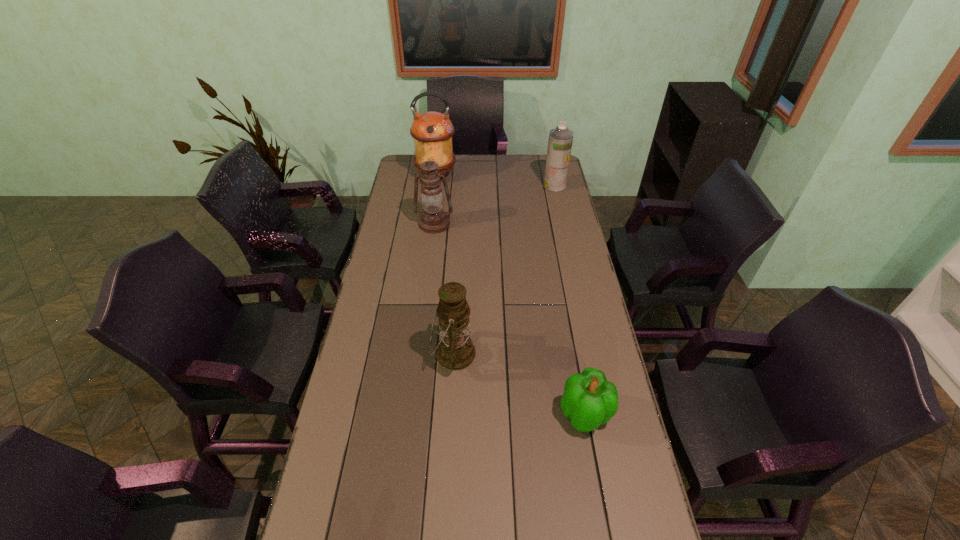
Where is `free space between the bell pepper and the fourth farthest object`? This screenshot has height=540, width=960. free space between the bell pepper and the fourth farthest object is located at coordinates (519, 384).

At what (x,y) coordinates should I click in order to perform the action: click on free spot between the tallest oil lamp and the nearest oil lamp. Please return your answer as a coordinate pair (x, y). The image size is (960, 540). Looking at the image, I should click on (444, 264).

This screenshot has width=960, height=540. I want to click on free space between the shortest object and the tallest oil lamp, so click(x=511, y=295).

Find the location of a particular element. This screenshot has height=540, width=960. free space between the aerosol can and the second nearest object is located at coordinates (504, 269).

Image resolution: width=960 pixels, height=540 pixels. I want to click on vacant space that is in between the tallest object and the nearest oil lamp, so click(x=444, y=264).

Where is `vacant area that lies between the bell pepper and the farthest oil lamp`? vacant area that lies between the bell pepper and the farthest oil lamp is located at coordinates [511, 295].

Locate an element on the screen. Image resolution: width=960 pixels, height=540 pixels. object that can be found as the third closest to the aerosol can is located at coordinates (455, 351).

Identify which object is the fourth nearest to the nearest oil lamp. Please provide its 2D coordinates. Your answer should be formatted as a tuple, i.e. [(x, y)], where the tuple contains the x and y coordinates of a point satisfying the conditions above.

[(560, 141)]

Select which oil lamp is the closest to the second farthest oil lamp. Please provide its 2D coordinates. Your answer should be formatted as a tuple, i.e. [(x, y)], where the tuple contains the x and y coordinates of a point satisfying the conditions above.

[(432, 131)]

Where is `the second closest oil lamp to the shortest object`? Image resolution: width=960 pixels, height=540 pixels. the second closest oil lamp to the shortest object is located at coordinates (434, 219).